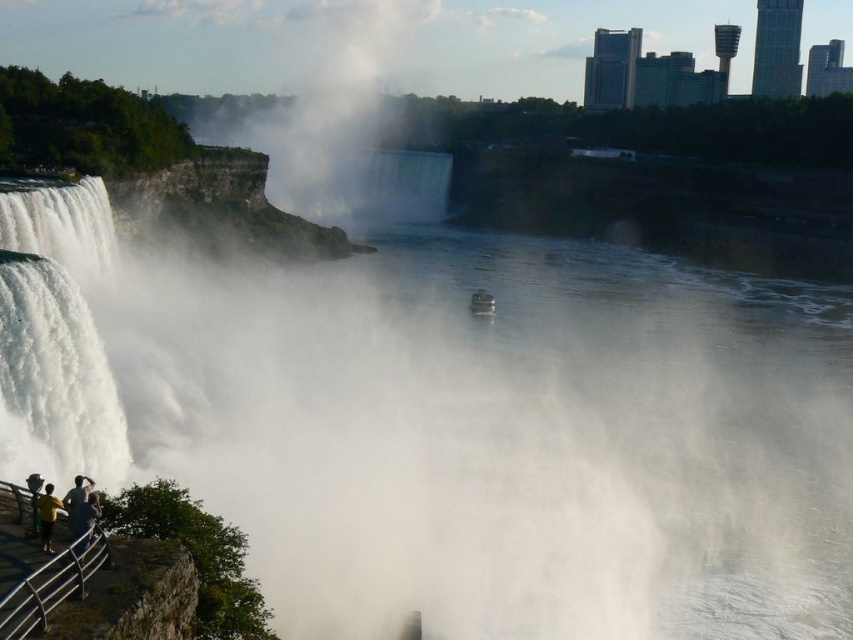
Is white misty water at left closer to the viewer compared to yellow t-shirt at lower left?

That is False.

You are a GUI agent. You are given a task and a screenshot of the screen. Output one action in this format:
    pyautogui.click(x=<x>, y=<y>)
    Task: Click on the white misty water at left
    This screenshot has height=640, width=853.
    Given the screenshot: What is the action you would take?
    pyautogui.click(x=456, y=433)

Is point (27, 448) in front of point (53, 496)?

No.

Image resolution: width=853 pixels, height=640 pixels. What do you see at coordinates (56, 339) in the screenshot?
I see `white frothy water at left` at bounding box center [56, 339].

Where is `white frothy water at left`? The height and width of the screenshot is (640, 853). white frothy water at left is located at coordinates (56, 339).

Is point (65, 344) positioned behind point (473, 292)?

No, it is in front of (473, 292).

Who is positioned more to the left, white frothy water at left or metallic gray boat at center?

Positioned to the left is white frothy water at left.

Is point (1, 460) farther from viewer compared to point (483, 314)?

No.

What are the coordinates of `white frothy water at left` in the screenshot? It's located at (56, 339).